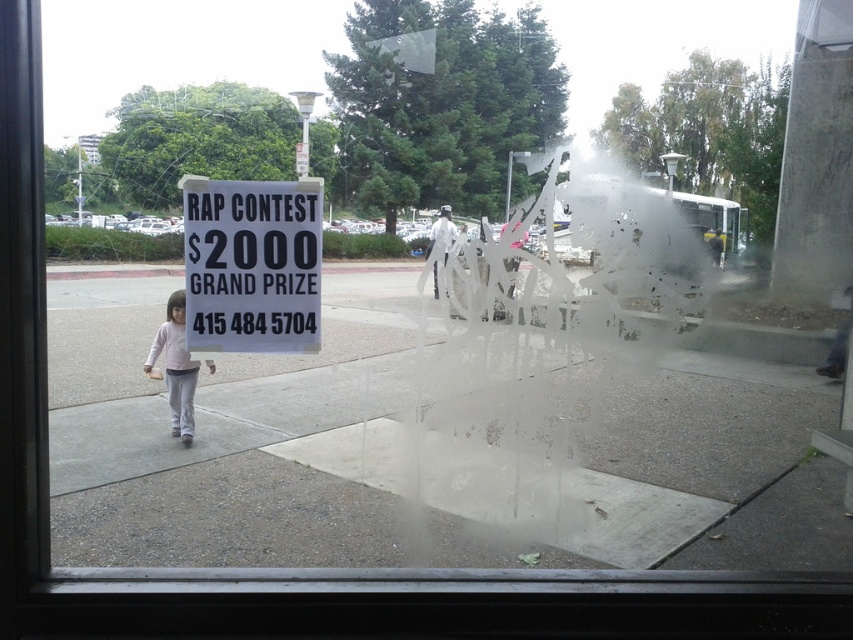
What do you see at coordinates (252, 264) in the screenshot?
I see `white paper sign at center` at bounding box center [252, 264].

How far apart are white paper sign at center and light pink fabric child at lower left?

white paper sign at center is 9.53 feet away from light pink fabric child at lower left.

Is point (260, 316) farther from viewer compared to point (175, 301)?

No, it is in front of (175, 301).

Where is `white paper sign at center`? This screenshot has width=853, height=640. white paper sign at center is located at coordinates 252,264.